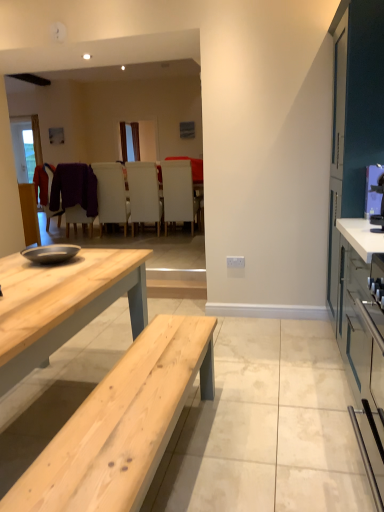
Question: From a real-world perspective, is white matte chair at center, arranged as the 2th chair when viewed from the right, physically above purple fuzzy sweater at center?

Choices:
 (A) yes
 (B) no

Answer: (B)

Question: Can you confirm if white matte chair at center, arranged as the 2th chair when viewed from the right, is thinner than purple fuzzy sweater at center?

Choices:
 (A) no
 (B) yes

Answer: (A)

Question: From the image's perspective, is white matte chair at center, arranged as the 2th chair when viewed from the right, above purple fuzzy sweater at center?

Choices:
 (A) yes
 (B) no

Answer: (B)

Question: From a real-world perspective, is white matte chair at center, arranged as the 2th chair when viewed from the right, physically below purple fuzzy sweater at center?

Choices:
 (A) no
 (B) yes

Answer: (B)

Question: Is white matte chair at center, arranged as the 2th chair when viewed from the right, facing towards purple fuzzy sweater at center?

Choices:
 (A) no
 (B) yes

Answer: (A)

Question: Is white matte chair at center, placed as the 3th chair when sorted from left to right, touching purple fuzzy sweater at center?

Choices:
 (A) yes
 (B) no

Answer: (B)

Question: Is purple fuzzy sweater at center shorter than white matte chair at center, arranged as the 2th chair when viewed from the right?

Choices:
 (A) yes
 (B) no

Answer: (A)

Question: Is purple fuzzy sweater at center outside white matte chair at center, placed as the 3th chair when sorted from left to right?

Choices:
 (A) no
 (B) yes

Answer: (B)

Question: From a real-world perspective, does purple fuzzy sweater at center sit lower than white matte chair at center, placed as the 3th chair when sorted from left to right?

Choices:
 (A) yes
 (B) no

Answer: (B)

Question: Does purple fuzzy sweater at center have a lesser width compared to white matte chair at center, arranged as the 2th chair when viewed from the right?

Choices:
 (A) yes
 (B) no

Answer: (A)

Question: Does purple fuzzy sweater at center appear on the right side of white matte chair at center, placed as the 3th chair when sorted from left to right?

Choices:
 (A) no
 (B) yes

Answer: (A)

Question: Are purple fuzzy sweater at center and white matte chair at center, placed as the 3th chair when sorted from left to right, located far from each other?

Choices:
 (A) no
 (B) yes

Answer: (A)

Question: Considering the relative sizes of white leather chair at center, positioned as the third chair in right-to-left order, and metallic blue microwave at right in the image provided, is white leather chair at center, positioned as the third chair in right-to-left order, thinner than metallic blue microwave at right?

Choices:
 (A) yes
 (B) no

Answer: (B)